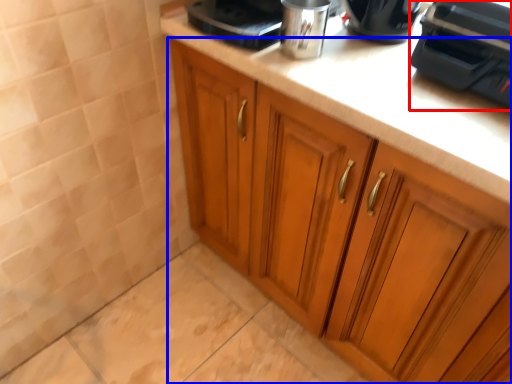
Question: Which point is closer to the camera, home appliance (highlighted by a red box) or cabinetry (highlighted by a blue box)?

Choices:
 (A) home appliance
 (B) cabinetry

Answer: (B)